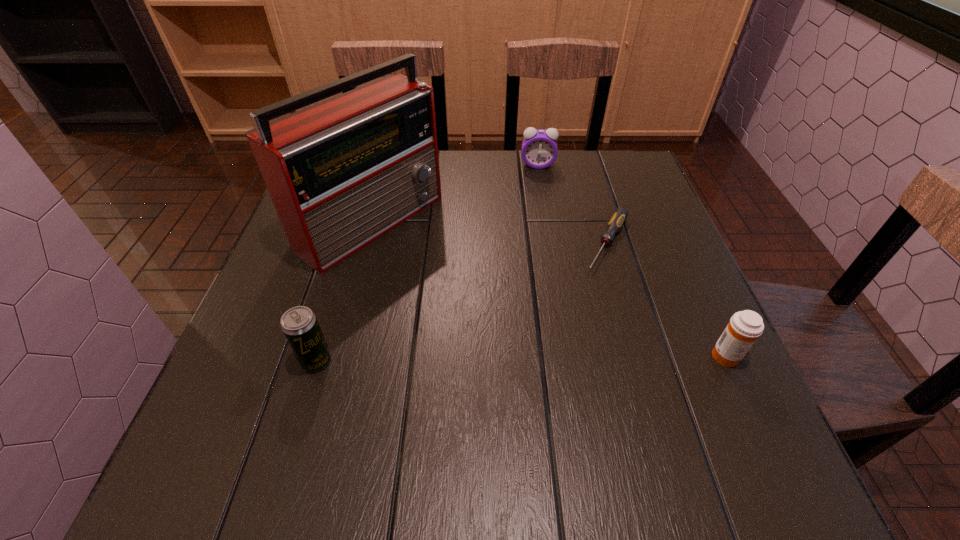
Locate an element on the screen. vacant area at the far right corner of the desktop is located at coordinates (634, 161).

In the image, there is a desktop. Where is `free region at the near right corner`? Image resolution: width=960 pixels, height=540 pixels. free region at the near right corner is located at coordinates (665, 380).

In order to click on free spot between the tallest object and the screwdriver in this screenshot , I will do `click(489, 232)`.

Where is `empty space between the radio receiver and the alarm clock`? empty space between the radio receiver and the alarm clock is located at coordinates (454, 193).

Identify the location of vacant area that lies between the medicine and the farthest object. [633, 260].

Where is `free spot between the alarm clock and the medicine`? The width and height of the screenshot is (960, 540). free spot between the alarm clock and the medicine is located at coordinates 633,260.

The height and width of the screenshot is (540, 960). What are the coordinates of `vacant area that lies between the radio receiver and the shortest object` in the screenshot? It's located at (489, 232).

Locate an element on the screen. The width and height of the screenshot is (960, 540). empty location between the screwdriver and the beer can is located at coordinates (462, 302).

Identify the location of free space between the rightmost object and the fourth object from left to right. The image size is (960, 540). (667, 300).

Image resolution: width=960 pixels, height=540 pixels. I want to click on free point between the radio receiver and the rightmost object, so click(548, 289).